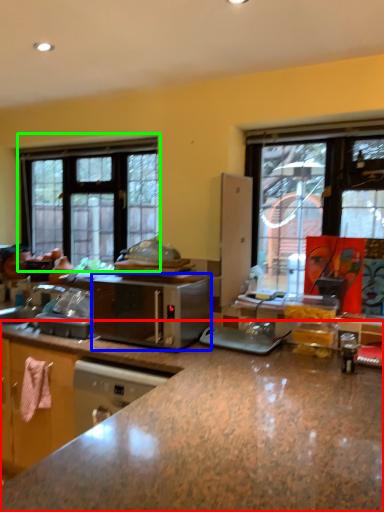
Question: Which object is positioned closest to countertop (highlighted by a red box)? Select from microwave oven (highlighted by a blue box) and window (highlighted by a green box).

Choices:
 (A) microwave oven
 (B) window

Answer: (A)